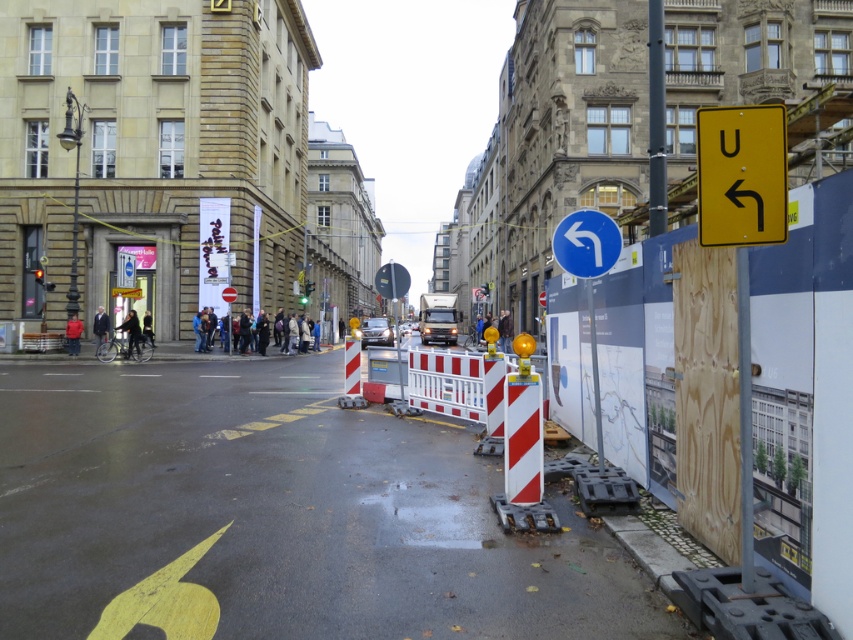
Question: Which point appears closest to the camera in this image?

Choices:
 (A) (727, 113)
 (B) (439, 410)
 (C) (265, 332)
 (D) (135, 346)

Answer: (A)

Question: Which point is farther to the camera?

Choices:
 (A) (74, 340)
 (B) (152, 344)

Answer: (B)

Question: Which of the following is the closest to the observer?

Choices:
 (A) (305, 349)
 (B) (135, 326)
 (C) (457, 356)
 (D) (779, 240)

Answer: (D)

Question: Does blue fabric jacket at center appear over dark blue jacket at left?

Choices:
 (A) yes
 (B) no

Answer: (B)

Question: From the image, what is the correct spatial relationship of blue fabric jacket at center in relation to dark blue jacket at left?

Choices:
 (A) below
 (B) above

Answer: (A)

Question: Is the position of blue fabric jacket at center more distant than that of red fabric jacket at center?

Choices:
 (A) no
 (B) yes

Answer: (B)